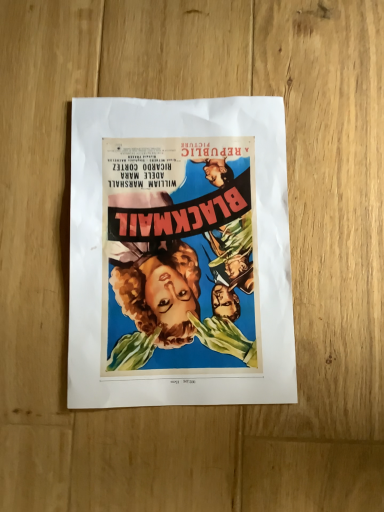
What do you see at coordinates (179, 254) in the screenshot? I see `vibrant paper poster at center` at bounding box center [179, 254].

Find the location of a particular element. vibrant paper poster at center is located at coordinates (179, 254).

Locate an element on the screen. This screenshot has width=384, height=512. vibrant paper poster at center is located at coordinates (179, 254).